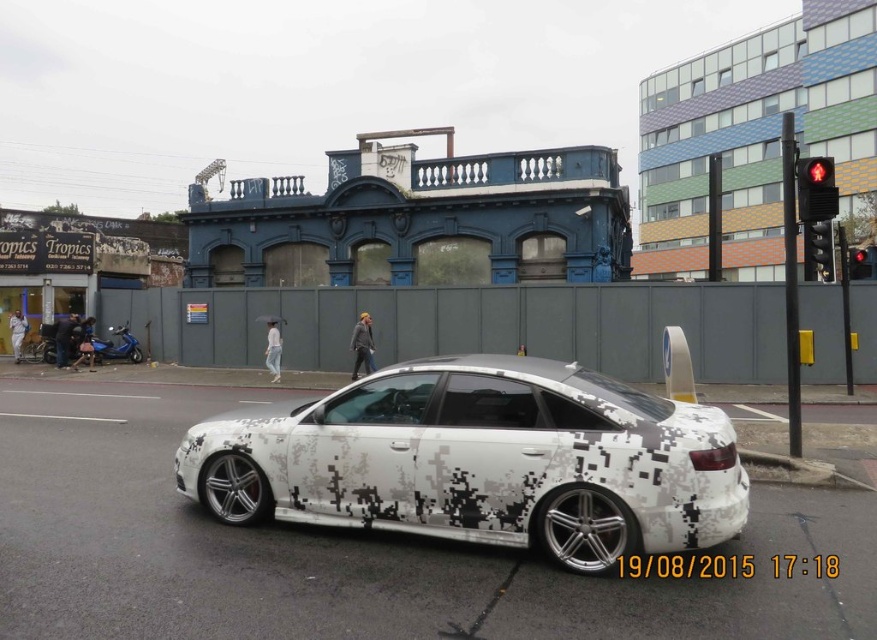
Question: Is red plastic pedestrian signal at upper right above metallic black traffic light at right?

Choices:
 (A) no
 (B) yes

Answer: (B)

Question: Does red plastic pedestrian signal at upper right appear on the right side of red plastic traffic light at upper right?

Choices:
 (A) no
 (B) yes

Answer: (A)

Question: Which of the following is the closest to the observer?

Choices:
 (A) white camouflage car at center
 (B) metallic black traffic light at right
 (C) red plastic traffic light at upper right

Answer: (A)

Question: Among these objects, which one is farthest from the camera?

Choices:
 (A) white camouflage car at center
 (B) red plastic pedestrian signal at upper right

Answer: (B)

Question: Is white camouflage car at center positioned before red plastic pedestrian signal at upper right?

Choices:
 (A) yes
 (B) no

Answer: (A)

Question: Which object is farther from the camera taking this photo?

Choices:
 (A) metallic black traffic light at right
 (B) red plastic traffic light at upper right
 (C) white camouflage car at center

Answer: (B)